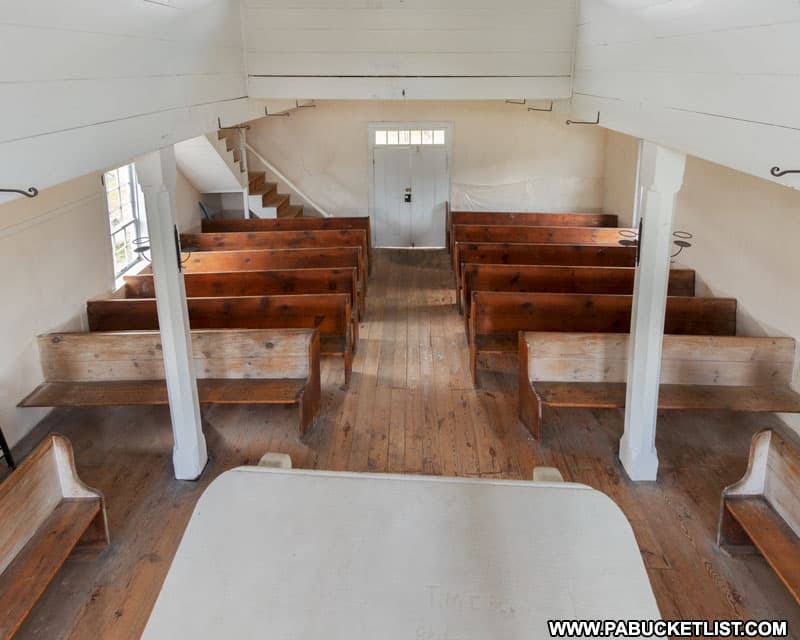
The width and height of the screenshot is (800, 640). What are the coordinates of `hook` in the screenshot? It's located at (786, 170), (594, 122), (525, 106), (512, 100), (306, 102), (285, 114), (242, 128), (30, 192).